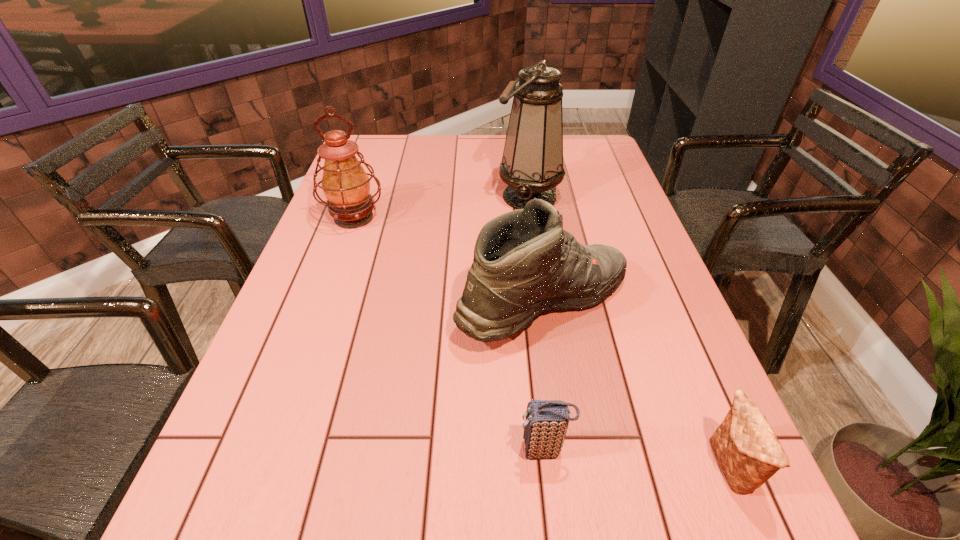
Locate an element on the screen. The width and height of the screenshot is (960, 540). empty location between the leftmost object and the third tallest object is located at coordinates (449, 261).

Find the location of a particular element. The height and width of the screenshot is (540, 960). empty location between the third farthest object and the shorter oil lamp is located at coordinates (449, 261).

This screenshot has height=540, width=960. In order to click on vacant point located between the left clutch bag and the rightmost object in this screenshot , I will do `click(636, 458)`.

Select which object appears as the fourth closest to the right oil lamp. Please provide its 2D coordinates. Your answer should be formatted as a tuple, i.e. [(x, y)], where the tuple contains the x and y coordinates of a point satisfying the conditions above.

[(747, 450)]

Where is `object that stands as the closest to the right clutch bag`? This screenshot has height=540, width=960. object that stands as the closest to the right clutch bag is located at coordinates (524, 262).